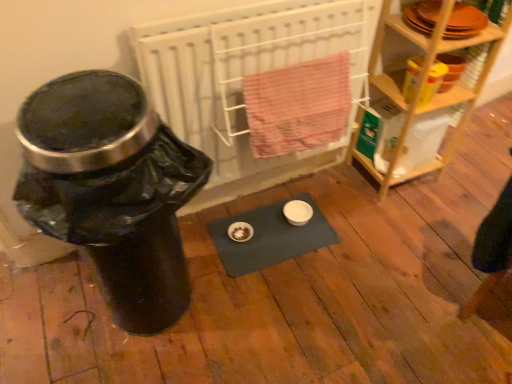
Locate an element on the screen. This screenshot has height=384, width=512. free space below blue fabric yoga mat at center (from a real-world perspective) is located at coordinates [265, 233].